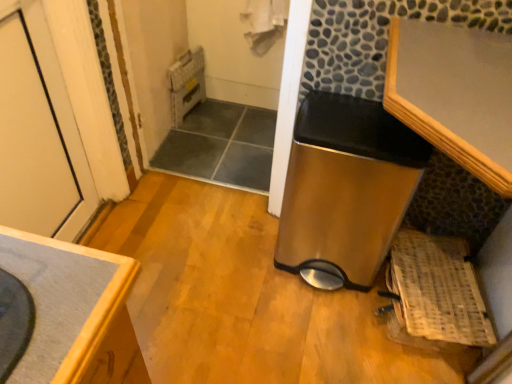
The image size is (512, 384). Identify the location of vacant point above stainless steel trash can at center, the 1th water heater positioned from the right (from a real-world perspective). (349, 114).